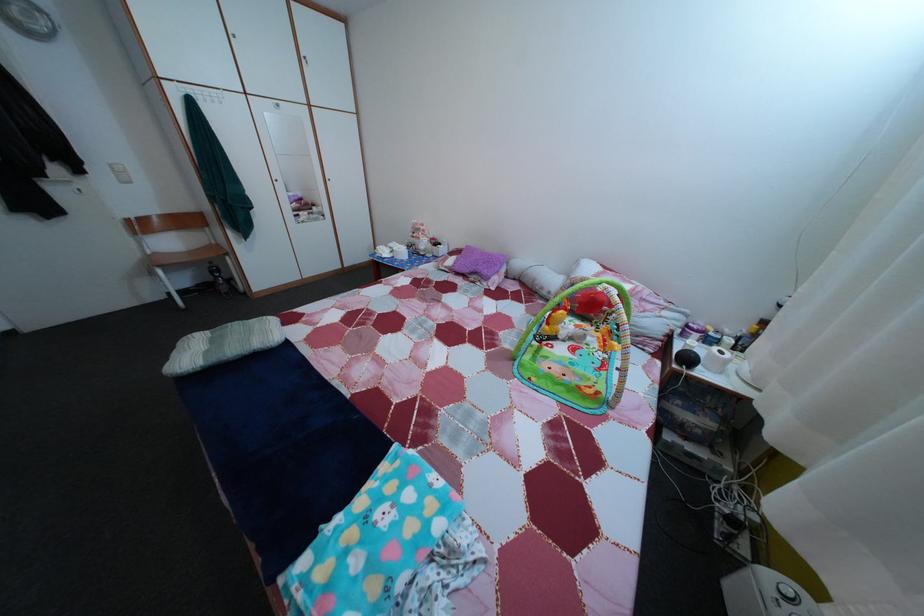
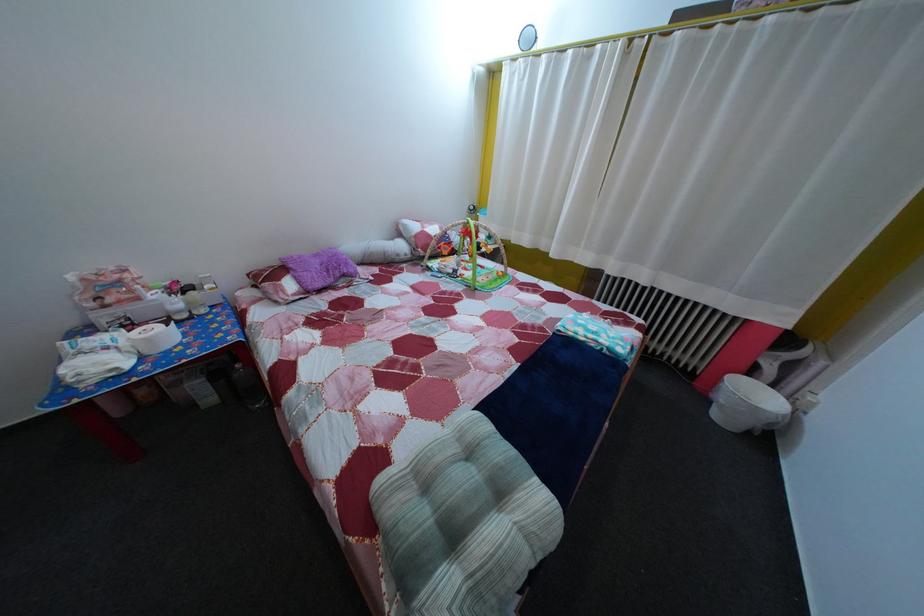
Locate, in the second image, the point that corresponds to the point at 492,261 in the first image.

(325, 262)